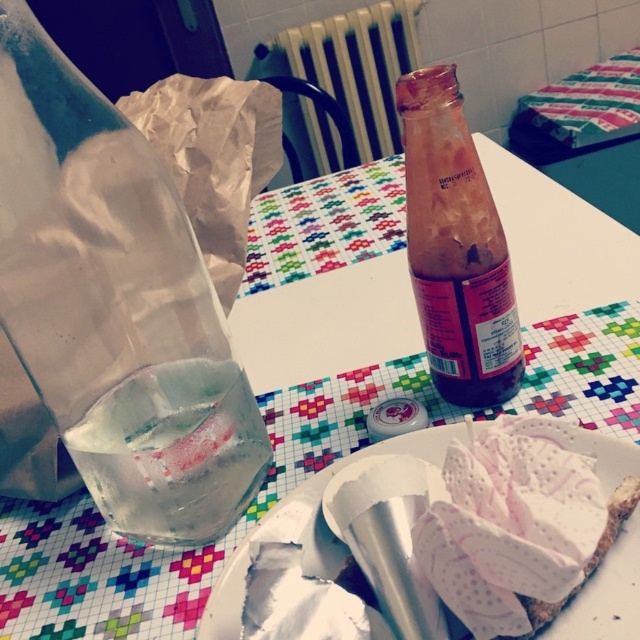
Is translucent glass bottle at center below white paper plate at lower right?

No, translucent glass bottle at center is not below white paper plate at lower right.

Between translucent glass bottle at center and white paper plate at lower right, which one appears on the right side from the viewer's perspective?

translucent glass bottle at center

What are the coordinates of `translucent glass bottle at center` in the screenshot? It's located at (456, 248).

Which is below, clear glass bottle at left or white paper plate at lower right?

Positioned lower is white paper plate at lower right.

Does clear glass bottle at left have a smaller size compared to white paper plate at lower right?

Correct, clear glass bottle at left occupies less space than white paper plate at lower right.

Where is `clear glass bottle at left`? This screenshot has height=640, width=640. clear glass bottle at left is located at coordinates (173, 451).

Who is positioned more to the left, clear glass bottle at left or metallic radiator at upper center?

clear glass bottle at left is more to the left.

Who is positioned more to the right, clear glass bottle at left or metallic radiator at upper center?

metallic radiator at upper center is more to the right.

Is point (108, 483) positioned in front of point (333, 160)?

That is True.

Locate an element on the screen. The height and width of the screenshot is (640, 640). clear glass bottle at left is located at coordinates (173, 451).